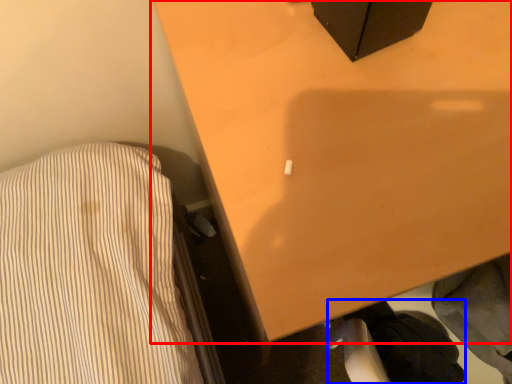
Question: Which object appears farthest to the camera in this image, furniture (highlighted by a red box) or clothing (highlighted by a blue box)?

Choices:
 (A) furniture
 (B) clothing

Answer: (B)